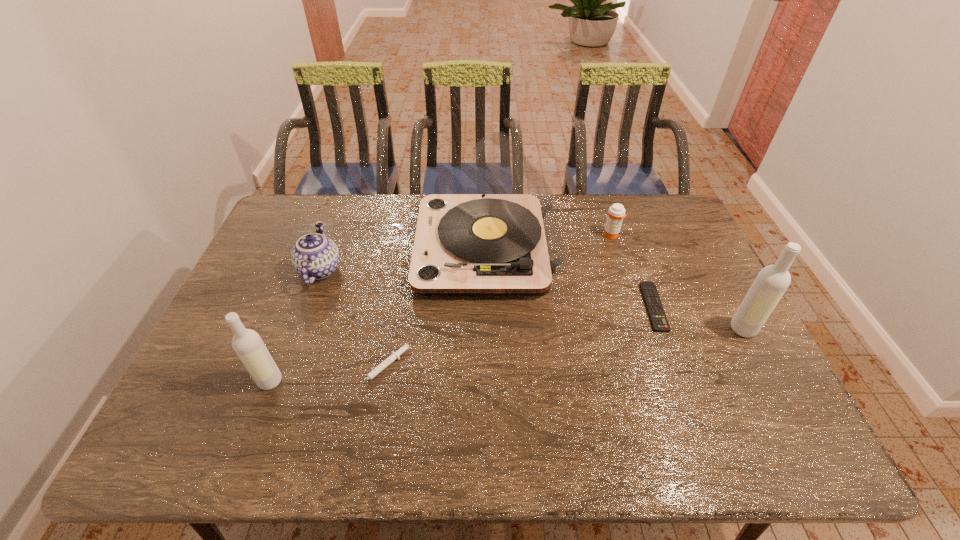
Identify the location of vacant space that satisfies the following two spatial constraints: 1. at the spout of the syringe; 2. on the left side of the chinaware. (284, 368).

Where is `free point that satisfies the following two spatial constraints: 1. on the back side of the third shortest object; 2. on the right side of the sixth tallest object`? This screenshot has width=960, height=540. free point that satisfies the following two spatial constraints: 1. on the back side of the third shortest object; 2. on the right side of the sixth tallest object is located at coordinates (408, 235).

Find the location of `vacant space that satisfies the following two spatial constraints: 1. with the tonearm facing the front of the tallest object; 2. on the front side of the sixth tallest object`. vacant space that satisfies the following two spatial constraints: 1. with the tonearm facing the front of the tallest object; 2. on the front side of the sixth tallest object is located at coordinates (488, 368).

The width and height of the screenshot is (960, 540). Identify the location of vacant space that satisfies the following two spatial constraints: 1. with the tonearm facing the front of the remote control; 2. on the right side of the tallest object. (487, 307).